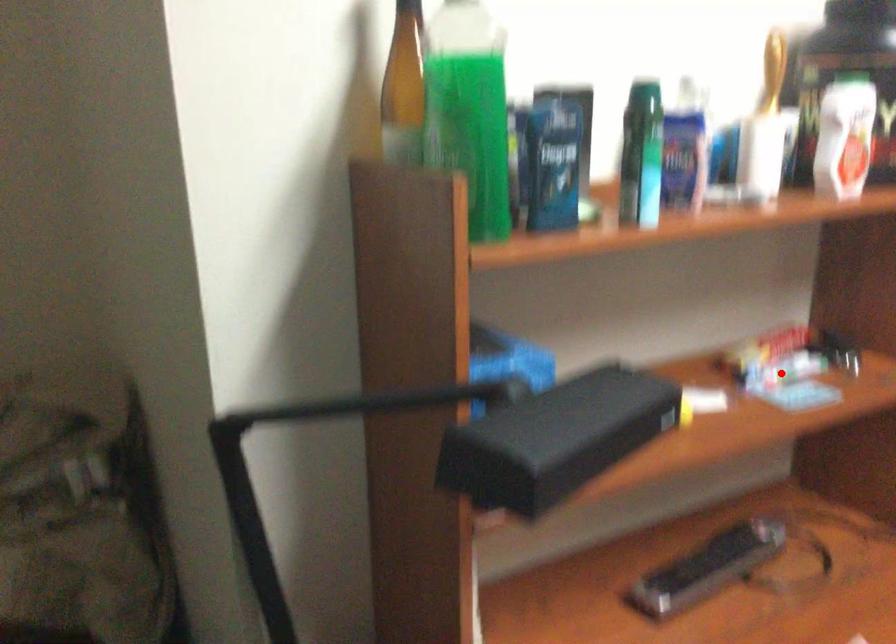
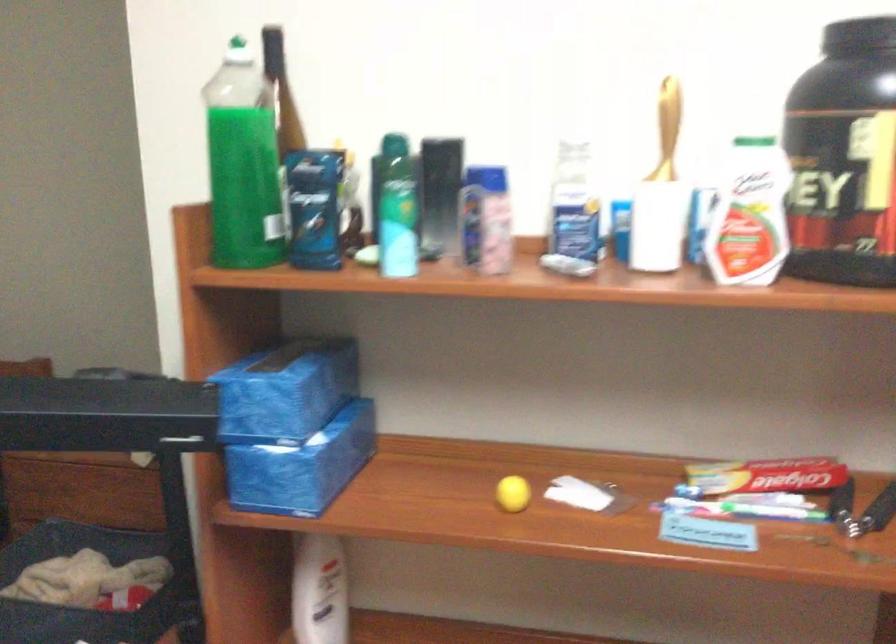
Question: I am providing you with two images of the same scene from different viewpoints. In image1, a red point is highlighted. Considering the same 3D point in image2, which of the following is correct?

Choices:
 (A) It is closer
 (B) It is farther

Answer: (A)